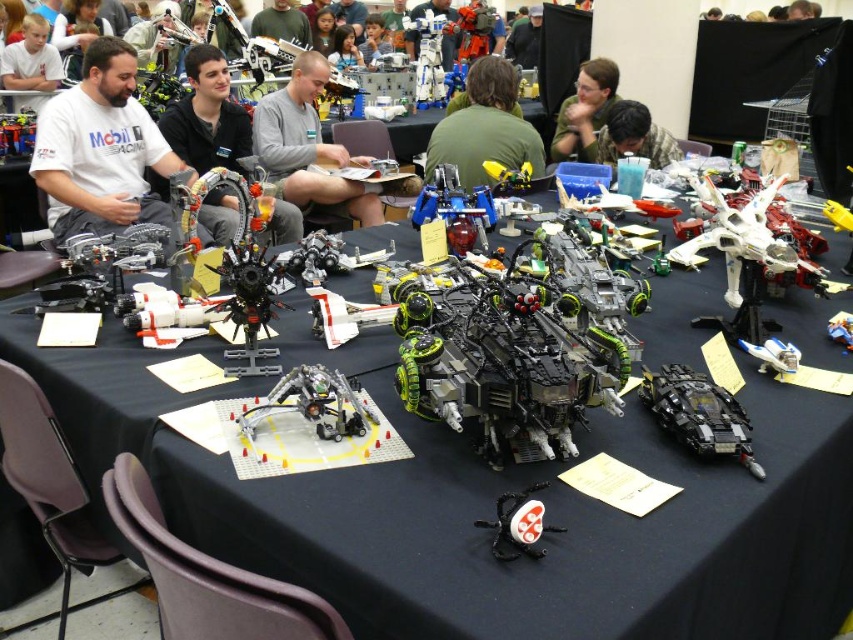
Locate an element on the screen. black plastic tank at lower right is located at coordinates (698, 413).

Between black plastic tank at lower right and blonde hair boy at upper left, which one appears on the right side from the viewer's perspective?

black plastic tank at lower right

Where is `black plastic tank at lower right`? Image resolution: width=853 pixels, height=640 pixels. black plastic tank at lower right is located at coordinates (698, 413).

Locate an element on the screen. black plastic tank at lower right is located at coordinates (698, 413).

Between blonde hair boy at upper left and matte black toy at upper left, which one has more height?

Standing taller between the two is blonde hair boy at upper left.

Does blonde hair boy at upper left have a greater width compared to matte black toy at upper left?

Correct, the width of blonde hair boy at upper left exceeds that of matte black toy at upper left.

This screenshot has height=640, width=853. What do you see at coordinates (32, 60) in the screenshot?
I see `blonde hair boy at upper left` at bounding box center [32, 60].

Locate an element on the screen. This screenshot has width=853, height=640. blonde hair boy at upper left is located at coordinates (32, 60).

Who is shorter, shiny metallic engine at center or white plastic robot at upper center?

shiny metallic engine at center

Identify the location of shiny metallic engine at center. The image size is (853, 640). [247, 273].